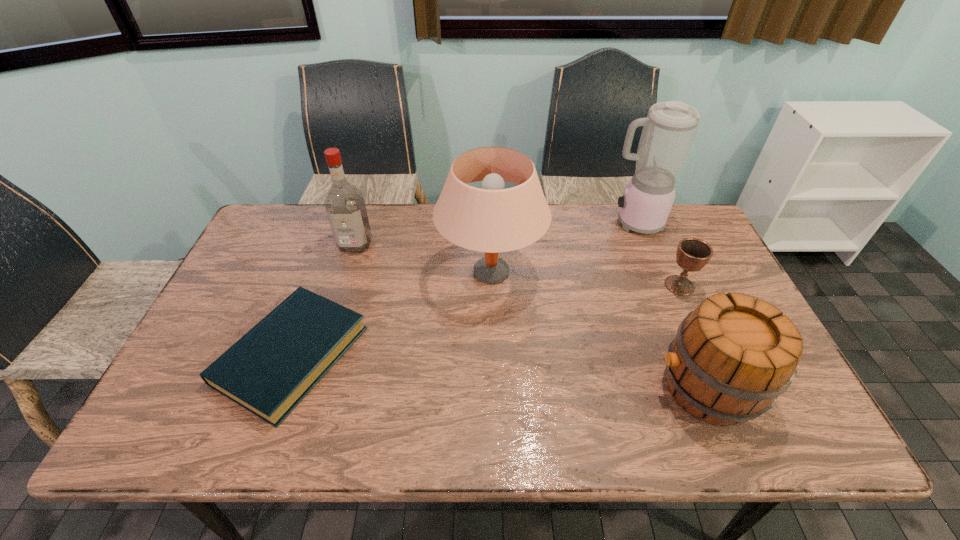
Identify the location of free location located 0.400m on the front-facing side of the lampshade. The image size is (960, 540). (303, 272).

You are a GUI agent. You are given a task and a screenshot of the screen. Output one action in this format:
    pyautogui.click(x=<x>, y=<y>)
    Task: Click on the free point located on the front-facing side of the lampshade
    This screenshot has width=960, height=540.
    Given the screenshot: What is the action you would take?
    pyautogui.click(x=411, y=272)

Where is `vacant area situated on the front-facing side of the liquor`? vacant area situated on the front-facing side of the liquor is located at coordinates (323, 350).

This screenshot has width=960, height=540. I want to click on free space located 0.200m on the side of the fourth tallest object where the spigot is located, so click(x=569, y=388).

At what (x,y) coordinates should I click in order to perform the action: click on vacant point located on the side of the fourth tallest object where the spigot is located. Please return your answer as a coordinate pair (x, y). This screenshot has height=540, width=960. Looking at the image, I should click on (505, 388).

You are a GUI agent. You are given a task and a screenshot of the screen. Output one action in this format:
    pyautogui.click(x=<x>, y=<y>)
    Task: Click on the free point located on the side of the fourth tallest object where the spigot is located
    Image resolution: width=960 pixels, height=540 pixels.
    Given the screenshot: What is the action you would take?
    pyautogui.click(x=522, y=388)

Identify the location of vacant space located 0.200m on the back of the chalice. (656, 232).

Locate an element on the screen. The image size is (960, 540). free region located 0.190m on the back of the book is located at coordinates (329, 253).

At what (x,y) coordinates should I click in order to perform the action: click on food processor present at the far edge. Please return your answer as a coordinate pair (x, y). Looking at the image, I should click on (669, 130).

At what (x,y) coordinates should I click in order to perform the action: click on lampshade that is positioned at the far edge. Please return your answer as a coordinate pair (x, y). The image size is (960, 540). Looking at the image, I should click on (493, 219).